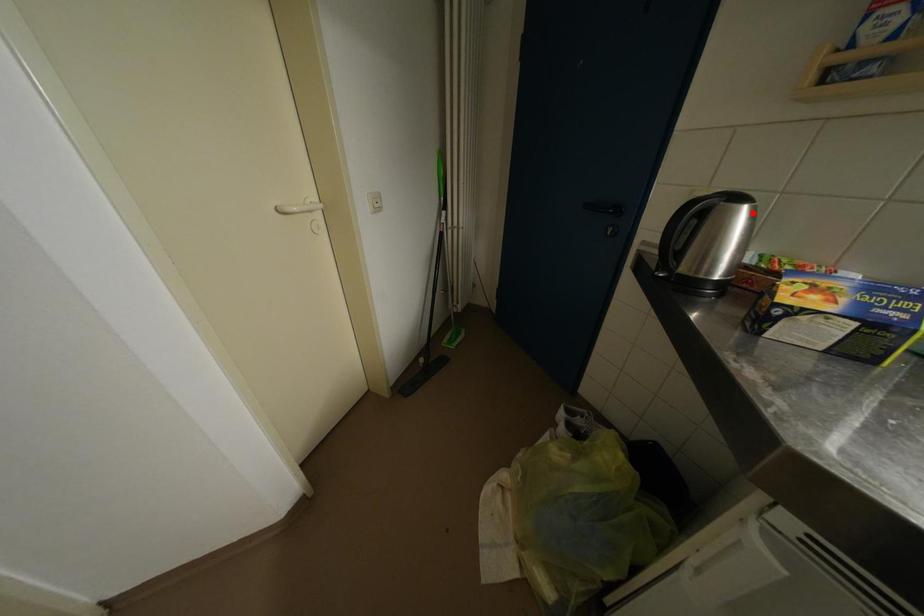
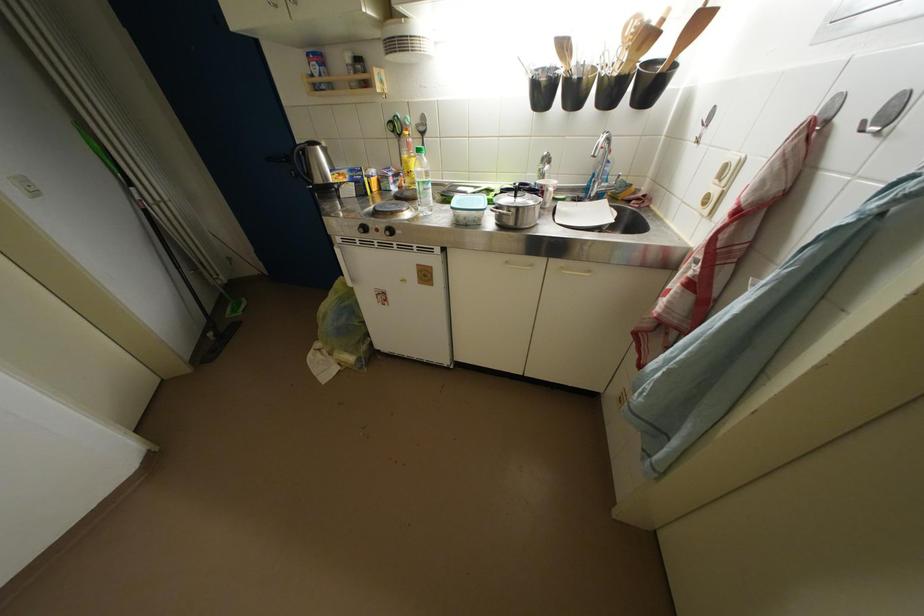
Question: I am providing you with two images of the same scene from different viewpoints. A red point is marked on the first image. Is the red point's position out of view in image 2?

Choices:
 (A) Yes
 (B) No

Answer: (B)